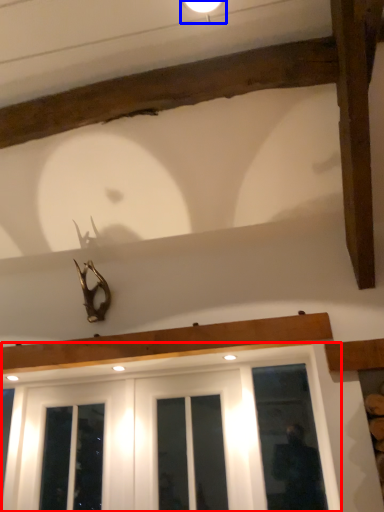
Question: Among these objects, which one is farthest to the camera, window (highlighted by a red box) or light fixture (highlighted by a blue box)?

Choices:
 (A) window
 (B) light fixture

Answer: (A)